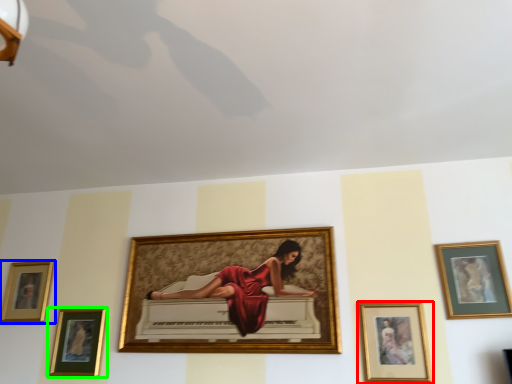
Question: Which is nearer to the picture frame (highlighted by a red box)? picture frame (highlighted by a blue box) or picture frame (highlighted by a green box).

Choices:
 (A) picture frame
 (B) picture frame

Answer: (B)